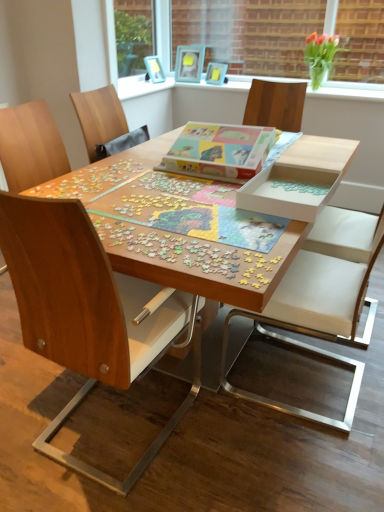
Question: Relative to wooden puzzle pieces at center, which is the second jigsaw puzzle from top to bottom, is matte plastic picture frame at upper center, which is counted as the first picture frame, starting from the right, in front or behind?

Choices:
 (A) front
 (B) behind

Answer: (B)

Question: Is matte plastic picture frame at upper center, which is counted as the first picture frame, starting from the right, wider or thinner than wooden puzzle pieces at center, the first jigsaw puzzle ordered from the bottom?

Choices:
 (A) wide
 (B) thin

Answer: (B)

Question: Which object is the farthest from the clear glass vase at upper center?

Choices:
 (A) wooden chair at left, the second chair from the right
 (B) wooden puzzle at center
 (C) matte plastic picture frame at upper center, which is counted as the first picture frame, starting from the right
 (D) green glass vase at upper right
 (E) wooden puzzle pieces at center, which is the second jigsaw puzzle from top to bottom

Answer: (D)

Question: Which object is positioned farthest from the wooden puzzle pieces at center, which is the second jigsaw puzzle from top to bottom?

Choices:
 (A) matte blue picture frame at upper center, which is the first picture frame from left to right
 (B) wooden puzzle at center
 (C) clear glass vase at upper center
 (D) wooden photo frame at upper center, the 2th picture frame in the left-to-right sequence
 (E) white leather chair at center, which is the 2th chair in left-to-right order

Answer: (C)